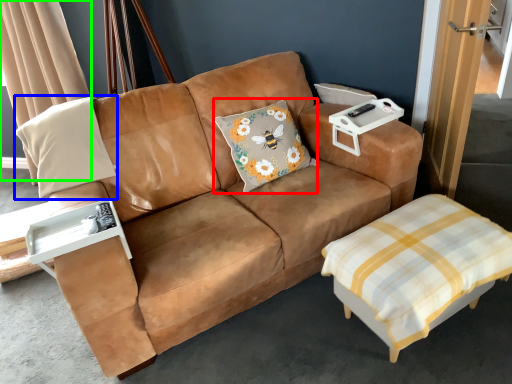
Question: Estimate the real-world distances between objects in this image. Which object is farther from throw pillow (highlighted by a red box), pillow (highlighted by a blue box) or curtain (highlighted by a green box)?

Choices:
 (A) pillow
 (B) curtain

Answer: (B)